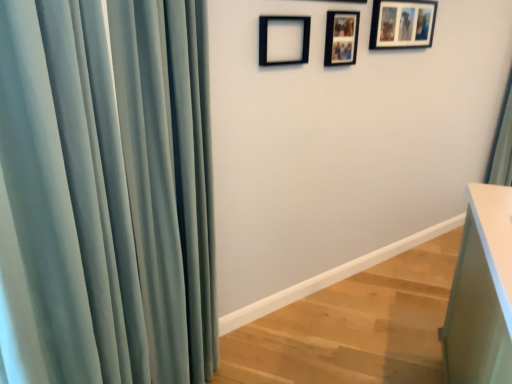
Question: From a real-world perspective, is white glossy vanity at lower right on black matte picture frame at upper center, positioned as the first picture frame in front-to-back order?

Choices:
 (A) no
 (B) yes

Answer: (A)

Question: From the image's perspective, is white glossy vanity at lower right beneath black matte picture frame at upper center, the first picture frame when ordered from left to right?

Choices:
 (A) yes
 (B) no

Answer: (A)

Question: From a real-world perspective, is white glossy vanity at lower right positioned under black matte picture frame at upper center, positioned as the first picture frame in front-to-back order, based on gravity?

Choices:
 (A) no
 (B) yes

Answer: (B)

Question: Does white glossy vanity at lower right have a lesser height compared to black matte picture frame at upper center, which ranks as the 3th picture frame in right-to-left order?

Choices:
 (A) yes
 (B) no

Answer: (B)

Question: Is white glossy vanity at lower right oriented towards black matte picture frame at upper center, which ranks as the 3th picture frame in right-to-left order?

Choices:
 (A) yes
 (B) no

Answer: (B)

Question: Does white glossy vanity at lower right appear on the left side of black matte picture frame at upper center, which ranks as the 3th picture frame in right-to-left order?

Choices:
 (A) yes
 (B) no

Answer: (B)

Question: Does white glossy vanity at lower right lie behind matte black picture frame at upper right, which is the third picture frame in left-to-right order?

Choices:
 (A) no
 (B) yes

Answer: (A)

Question: Can matte black picture frame at upper right, which is the third picture frame in front-to-back order, be found inside white glossy vanity at lower right?

Choices:
 (A) no
 (B) yes

Answer: (A)

Question: Would you say white glossy vanity at lower right is outside matte black picture frame at upper right, which is the third picture frame in left-to-right order?

Choices:
 (A) no
 (B) yes

Answer: (B)

Question: Is white glossy vanity at lower right bigger than matte black picture frame at upper right, the first picture frame in the back-to-front sequence?

Choices:
 (A) yes
 (B) no

Answer: (A)

Question: Does white glossy vanity at lower right have a lesser width compared to matte black picture frame at upper right, the first picture frame in the back-to-front sequence?

Choices:
 (A) no
 (B) yes

Answer: (A)

Question: Considering the relative sizes of white glossy vanity at lower right and matte black picture frame at upper right, the first picture frame in the back-to-front sequence, in the image provided, is white glossy vanity at lower right wider than matte black picture frame at upper right, the first picture frame in the back-to-front sequence,?

Choices:
 (A) no
 (B) yes

Answer: (B)

Question: Considering the relative sizes of matte black picture frame at upper right, which is the third picture frame in left-to-right order, and satin teal curtain at left in the image provided, is matte black picture frame at upper right, which is the third picture frame in left-to-right order, thinner than satin teal curtain at left?

Choices:
 (A) no
 (B) yes

Answer: (B)